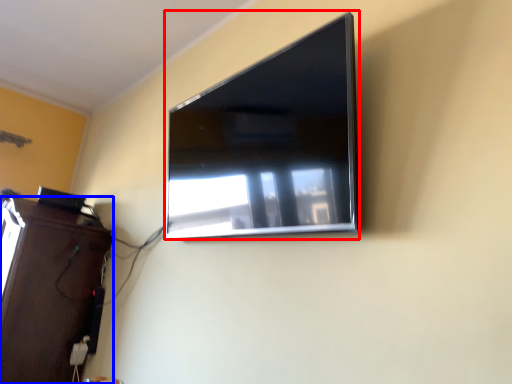
Question: Which object is closer to the camera taking this photo, television (highlighted by a red box) or furniture (highlighted by a blue box)?

Choices:
 (A) television
 (B) furniture

Answer: (A)